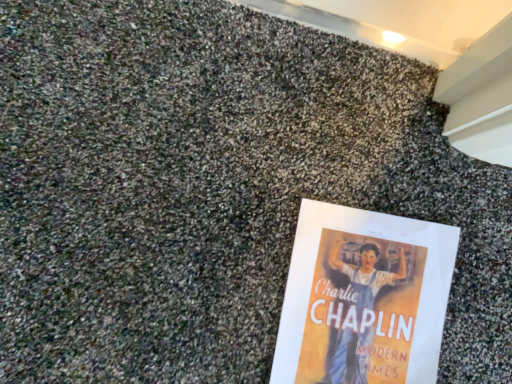
I want to click on vacant region above matte paper poster at lower right (from a real-world perspective), so click(369, 308).